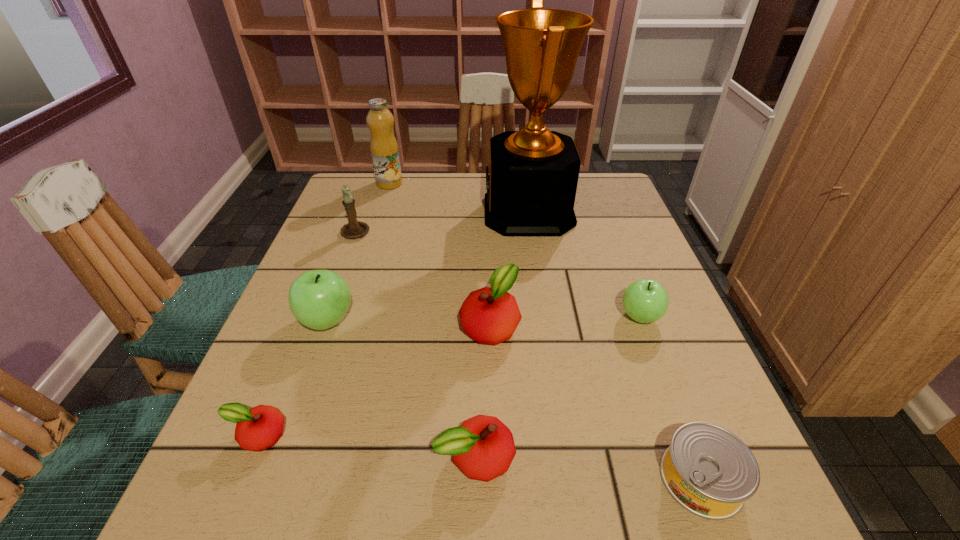
Locate an element on the screen. The height and width of the screenshot is (540, 960). vacant area between the fruit juice and the can is located at coordinates (545, 331).

Identify the location of vacant point located between the trophy cup and the second tallest object. The image size is (960, 540). (459, 198).

This screenshot has height=540, width=960. I want to click on free point between the smallest red apple and the candle holder, so click(x=307, y=333).

Identify the location of free space between the eighth shortest object and the second smallest red apple. This screenshot has width=960, height=540. (433, 320).

Locate an element on the screen. object that is the fourth closest one to the right green apple is located at coordinates (483, 447).

Identify the location of object that stands as the seventh closest to the second tallest object. (483, 447).

At what (x,y) coordinates should I click in order to perform the action: click on the fourth closest apple to the second smallest red apple. Please return your answer as a coordinate pair (x, y). Looking at the image, I should click on click(x=646, y=300).

The image size is (960, 540). In order to click on the fourth closest apple to the tallest apple in this screenshot , I will do `click(646, 300)`.

You are a GUI agent. You are given a task and a screenshot of the screen. Output one action in this format:
    pyautogui.click(x=<x>, y=<y>)
    Task: Click on the red apple that is the third nearest to the right green apple
    The image size is (960, 540).
    Given the screenshot: What is the action you would take?
    pyautogui.click(x=258, y=428)

Select which red apple is the third closest to the smaller green apple. Please provide its 2D coordinates. Your answer should be formatted as a tuple, i.e. [(x, y)], where the tuple contains the x and y coordinates of a point satisfying the conditions above.

[(258, 428)]